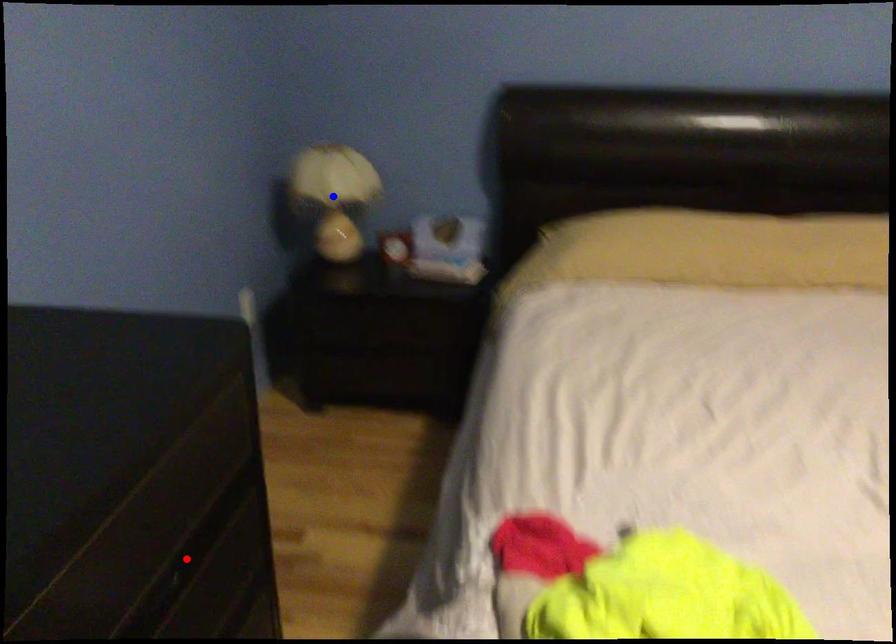
Question: Two points are marked on the image. Which point is closer to the camera?

Choices:
 (A) Blue point is closer.
 (B) Red point is closer.

Answer: (B)